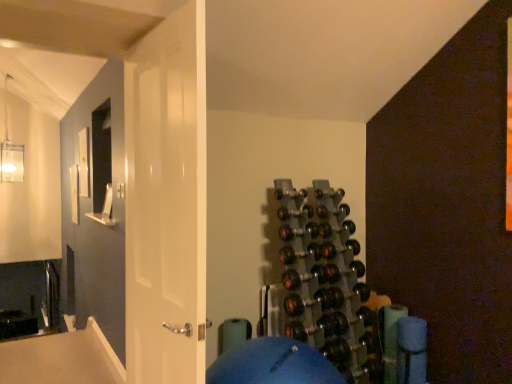
The width and height of the screenshot is (512, 384). What do you see at coordinates (322, 282) in the screenshot?
I see `metallic gray wine rack at center-right` at bounding box center [322, 282].

What is the approximate height of metallic gray wine rack at center-right?

It is 4.45 feet.

Identify the location of metallic gray wine rack at center-right. (322, 282).

What is the approximate width of white glossy door at center?

5.31 inches.

In order to face white glossy door at center, should I rotate leftwards or rightwards?

Rotate left and turn 12.213 degrees.

Find the location of a particular element. The width and height of the screenshot is (512, 384). white glossy door at center is located at coordinates (166, 201).

What do you see at coordinates (166, 201) in the screenshot? I see `white glossy door at center` at bounding box center [166, 201].

Where is `metallic gray wine rack at center-right`? metallic gray wine rack at center-right is located at coordinates (322, 282).

Does white glossy door at center appear on the left side of metallic gray wine rack at center-right?

Yes.

Is white glossy door at center closer to the viewer compared to metallic gray wine rack at center-right?

Yes, the depth of white glossy door at center is less than that of metallic gray wine rack at center-right.

Which is nearer, (169, 252) or (322, 333)?

Positioned in front is point (169, 252).

From the image's perspective, which is above, white glossy door at center or metallic gray wine rack at center-right?

white glossy door at center, from the image's perspective.

From a real-world perspective, is white glossy door at center positioned under metallic gray wine rack at center-right based on gravity?

No, from a real-world perspective, white glossy door at center is not beneath metallic gray wine rack at center-right.

Considering the sizes of objects white glossy door at center and metallic gray wine rack at center-right in the image provided, who is wider, white glossy door at center or metallic gray wine rack at center-right?

metallic gray wine rack at center-right.

Does white glossy door at center have a lesser height compared to metallic gray wine rack at center-right?

No, white glossy door at center is not shorter than metallic gray wine rack at center-right.

In terms of size, does white glossy door at center appear bigger or smaller than metallic gray wine rack at center-right?

Considering their sizes, white glossy door at center takes up less space than metallic gray wine rack at center-right.

Is white glossy door at center not inside metallic gray wine rack at center-right?

Yes, white glossy door at center is not within metallic gray wine rack at center-right.

Can you see white glossy door at center touching metallic gray wine rack at center-right?

No, white glossy door at center is not in contact with metallic gray wine rack at center-right.

Is white glossy door at center positioned with its back to metallic gray wine rack at center-right?

Absolutely, white glossy door at center is directed away from metallic gray wine rack at center-right.

Where is `wine rack that appears on the right of white glossy door at center`? wine rack that appears on the right of white glossy door at center is located at coordinates (322, 282).

Based on their positions, is metallic gray wine rack at center-right located to the left or right of white glossy door at center?

metallic gray wine rack at center-right is to the right of white glossy door at center.

Is metallic gray wine rack at center-right behind white glossy door at center?

Yes, it is behind white glossy door at center.

Is point (300, 262) less distant than point (167, 156)?

No, it is behind (167, 156).

From the image's perspective, is metallic gray wine rack at center-right above or below white glossy door at center?

metallic gray wine rack at center-right is below white glossy door at center.

From a real-world perspective, which is physically below, metallic gray wine rack at center-right or white glossy door at center?

metallic gray wine rack at center-right is physically lower.

Looking at their sizes, would you say metallic gray wine rack at center-right is wider or thinner than white glossy door at center?

Considering their sizes, metallic gray wine rack at center-right looks broader than white glossy door at center.

Is metallic gray wine rack at center-right taller or shorter than white glossy door at center?

Clearly, metallic gray wine rack at center-right is shorter compared to white glossy door at center.

Based on the photo, considering the sizes of objects metallic gray wine rack at center-right and white glossy door at center in the image provided, who is smaller, metallic gray wine rack at center-right or white glossy door at center?

white glossy door at center is smaller.

Which is correct: metallic gray wine rack at center-right is inside white glossy door at center, or outside of it?

metallic gray wine rack at center-right is located beyond the bounds of white glossy door at center.

Is metallic gray wine rack at center-right next to white glossy door at center?

They are not placed beside each other.

Is metallic gray wine rack at center-right oriented away from white glossy door at center?

metallic gray wine rack at center-right does not have its back to white glossy door at center.

How different are the orientations of metallic gray wine rack at center-right and white glossy door at center in degrees?

They differ by 87.7 degrees in their facing directions.

Where is `door above the metallic gray wine rack at center-right (from a real-world perspective)`? This screenshot has width=512, height=384. door above the metallic gray wine rack at center-right (from a real-world perspective) is located at coordinates (166, 201).

The height and width of the screenshot is (384, 512). I want to click on wine rack that is on the right side of white glossy door at center, so click(x=322, y=282).

This screenshot has width=512, height=384. Find the location of `door above the metallic gray wine rack at center-right (from the image's perspective)`. door above the metallic gray wine rack at center-right (from the image's perspective) is located at coordinates (166, 201).